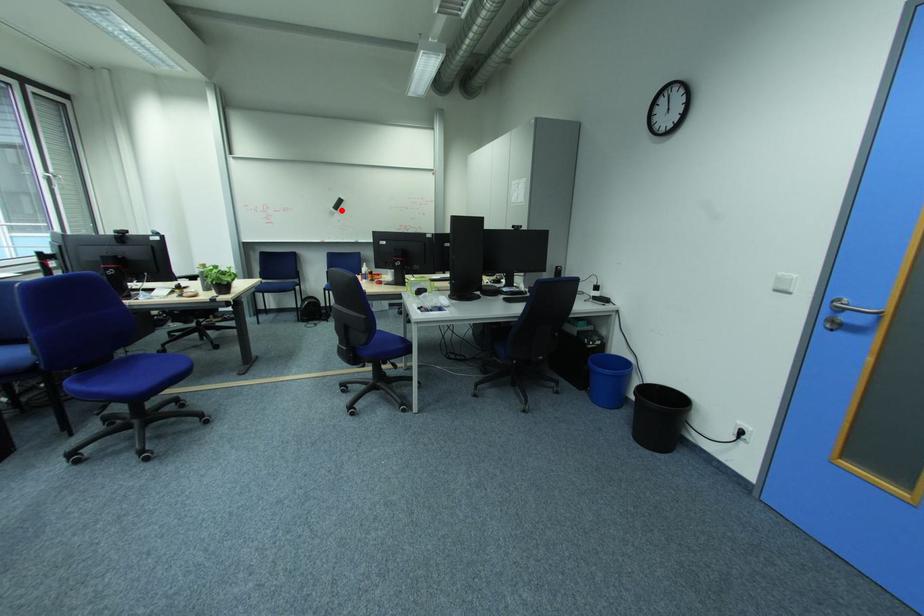
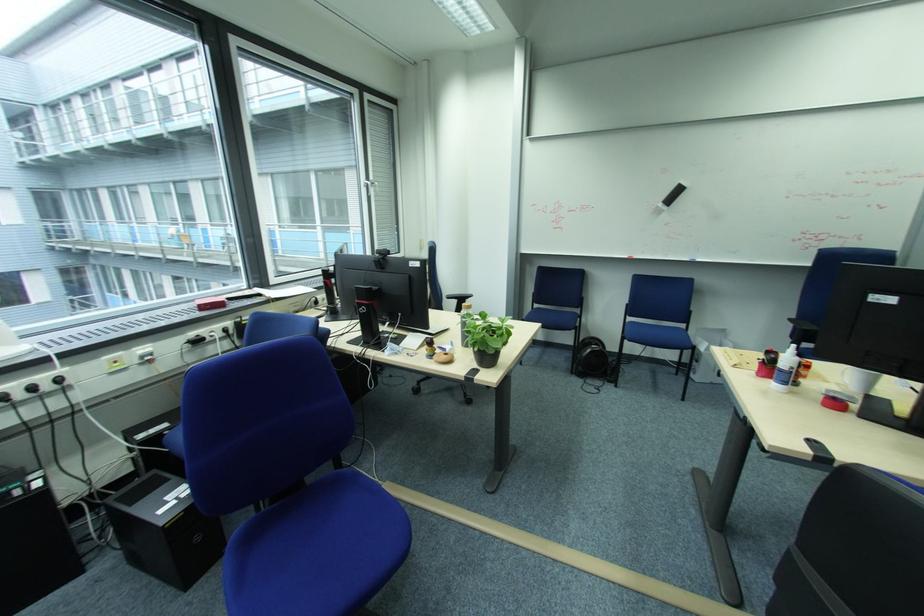
Question: I am providing you with two images of the same scene from different viewpoints. Image1 has a red point marked. In image2, the corresponding 3D location appears at what relative position? Reply with the corresponding letter.

Choices:
 (A) Closer
 (B) Farther

Answer: (B)